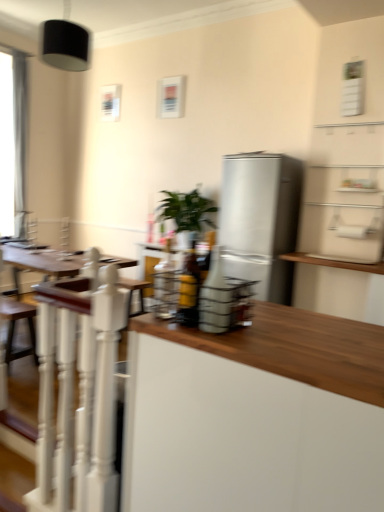
Question: Does white painted wood railing at left have a greater width compared to white matte cabinet at center?

Choices:
 (A) no
 (B) yes

Answer: (A)

Question: From the image's perspective, is white painted wood railing at left located beneath white matte cabinet at center?

Choices:
 (A) no
 (B) yes

Answer: (A)

Question: From the image's perspective, is white painted wood railing at left over white matte cabinet at center?

Choices:
 (A) yes
 (B) no

Answer: (A)

Question: Is white painted wood railing at left not inside white matte cabinet at center?

Choices:
 (A) yes
 (B) no

Answer: (A)

Question: Is white painted wood railing at left facing away from white matte cabinet at center?

Choices:
 (A) yes
 (B) no

Answer: (B)

Question: Considering the relative sizes of white painted wood railing at left and white matte cabinet at center in the image provided, is white painted wood railing at left smaller than white matte cabinet at center?

Choices:
 (A) yes
 (B) no

Answer: (A)

Question: From a real-world perspective, is brown wooden swivel chair at lower left positioned over satin silver refrigerator at center based on gravity?

Choices:
 (A) yes
 (B) no

Answer: (B)

Question: Is brown wooden swivel chair at lower left oriented away from satin silver refrigerator at center?

Choices:
 (A) no
 (B) yes

Answer: (A)

Question: Does brown wooden swivel chair at lower left come behind satin silver refrigerator at center?

Choices:
 (A) no
 (B) yes

Answer: (A)

Question: Is brown wooden swivel chair at lower left positioned before satin silver refrigerator at center?

Choices:
 (A) no
 (B) yes

Answer: (B)

Question: From the image's perspective, is brown wooden swivel chair at lower left under satin silver refrigerator at center?

Choices:
 (A) no
 (B) yes

Answer: (B)

Question: Is brown wooden swivel chair at lower left bigger than satin silver refrigerator at center?

Choices:
 (A) yes
 (B) no

Answer: (B)

Question: Is black matte lampshade at upper left oriented towards satin silver refrigerator at center?

Choices:
 (A) no
 (B) yes

Answer: (A)